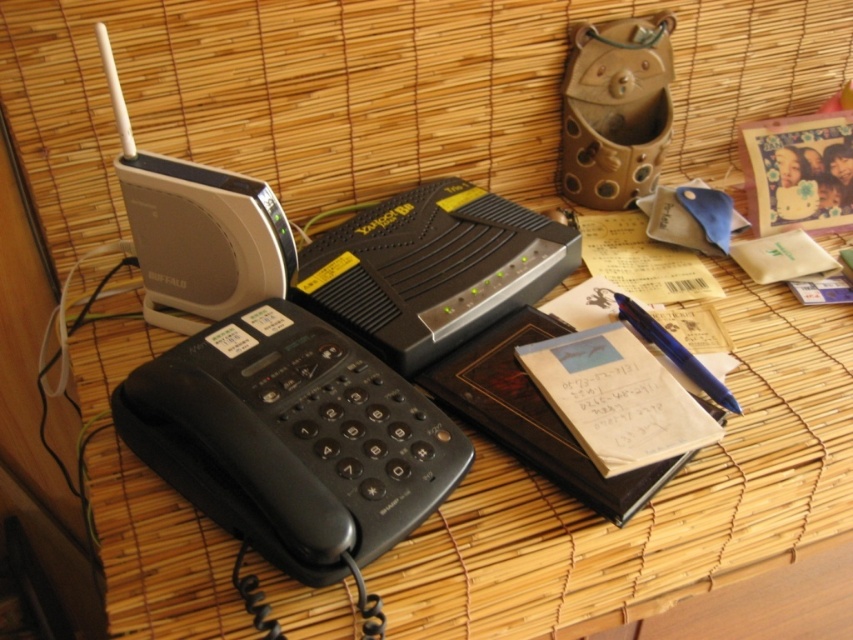
Which is below, black plastic phone at upper left or black plastic phone at lower left?

Positioned lower is black plastic phone at lower left.

What do you see at coordinates (648, 500) in the screenshot? I see `black plastic phone at upper left` at bounding box center [648, 500].

This screenshot has height=640, width=853. I want to click on black plastic phone at upper left, so click(x=648, y=500).

Is point (268, 308) farther from camera compared to point (664, 328)?

No.

Which is in front, point (334, 458) or point (694, 378)?

Point (334, 458) is in front.

Locate an element on the screen. This screenshot has width=853, height=640. black plastic phone at lower left is located at coordinates (293, 442).

Where is `black plastic phone at lower left`? The width and height of the screenshot is (853, 640). black plastic phone at lower left is located at coordinates (293, 442).

Does black plastic phone at upper left appear on the left side of blue metallic pen at right?

Indeed, black plastic phone at upper left is positioned on the left side of blue metallic pen at right.

Which is below, black plastic phone at upper left or blue metallic pen at right?

black plastic phone at upper left

The width and height of the screenshot is (853, 640). Find the location of `black plastic phone at upper left`. black plastic phone at upper left is located at coordinates (648, 500).

The width and height of the screenshot is (853, 640). What are the coordinates of `black plastic phone at upper left` in the screenshot? It's located at (648, 500).